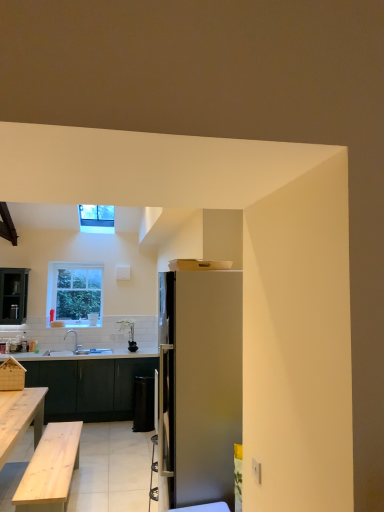
Question: From a real-world perspective, does satin silver refrigerator at center stand above white glossy coffee cup at center?

Choices:
 (A) yes
 (B) no

Answer: (B)

Question: Does satin silver refrigerator at center have a greater height compared to white glossy coffee cup at center?

Choices:
 (A) no
 (B) yes

Answer: (B)

Question: Is satin silver refrigerator at center not inside white glossy coffee cup at center?

Choices:
 (A) no
 (B) yes

Answer: (B)

Question: Is satin silver refrigerator at center wider than white glossy coffee cup at center?

Choices:
 (A) yes
 (B) no

Answer: (A)

Question: Is satin silver refrigerator at center at the left side of white glossy coffee cup at center?

Choices:
 (A) yes
 (B) no

Answer: (B)

Question: Is white glossy sink at lower left in front of or behind clear glass window at upper left, placed as the 2th window when sorted from front to back, in the image?

Choices:
 (A) front
 (B) behind

Answer: (A)

Question: From a real-world perspective, is white glossy sink at lower left physically located above or below clear glass window at upper left, positioned as the 1th window in back-to-front order?

Choices:
 (A) below
 (B) above

Answer: (A)

Question: In terms of height, does white glossy sink at lower left look taller or shorter compared to clear glass window at upper left, which appears as the 1th window when ordered from the bottom?

Choices:
 (A) tall
 (B) short

Answer: (B)

Question: From the image's perspective, relative to clear glass window at upper left, positioned as the second window in top-to-bottom order, is white glossy sink at lower left above or below?

Choices:
 (A) above
 (B) below

Answer: (B)

Question: Looking at the image, does clear glass window at upper center, which is the second window in back-to-front order, seem bigger or smaller compared to wooden table at lower left?

Choices:
 (A) small
 (B) big

Answer: (A)

Question: Is point (82, 210) closer or farther from the camera than point (97, 381)?

Choices:
 (A) closer
 (B) farther

Answer: (B)

Question: From the image's perspective, is clear glass window at upper center, which is the second window in back-to-front order, positioned above or below wooden table at lower left?

Choices:
 (A) below
 (B) above

Answer: (B)

Question: Visually, is clear glass window at upper center, which is the second window in back-to-front order, positioned to the left or to the right of wooden table at lower left?

Choices:
 (A) right
 (B) left

Answer: (A)

Question: From a real-world perspective, is white glossy coffee cup at center physically located above or below satin silver refrigerator at center?

Choices:
 (A) above
 (B) below

Answer: (A)

Question: Looking at the image, does white glossy coffee cup at center seem bigger or smaller compared to satin silver refrigerator at center?

Choices:
 (A) small
 (B) big

Answer: (A)